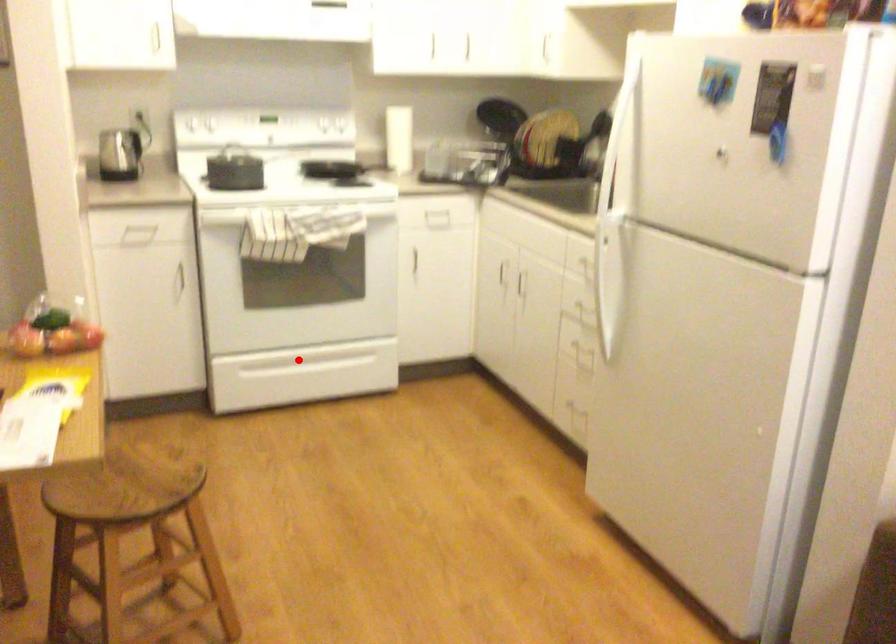
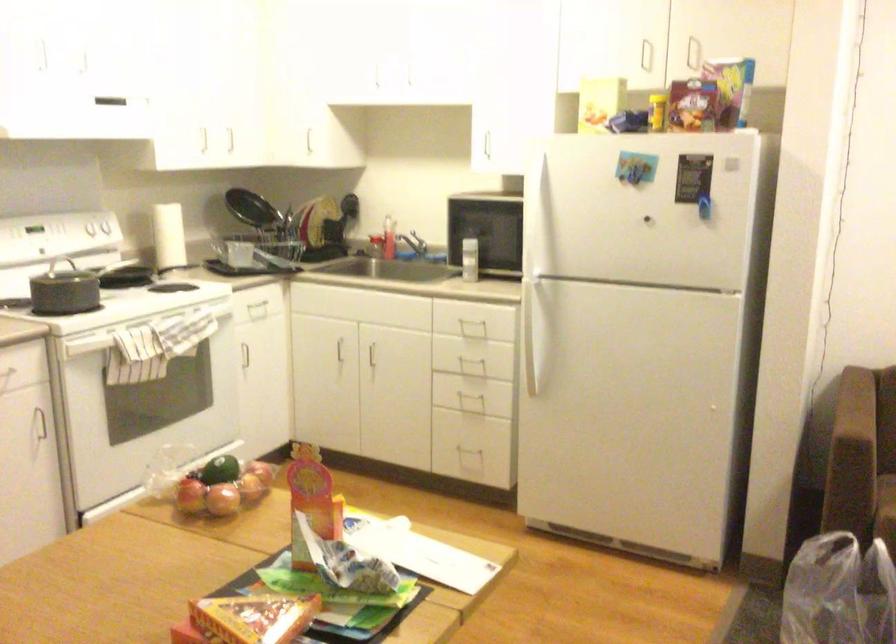
Question: I am providing you with two images of the same scene from different viewpoints. A red point is marked on the first image. At the location where the point appears in image 1, is it still visible in image 2?

Choices:
 (A) Yes
 (B) No

Answer: (B)